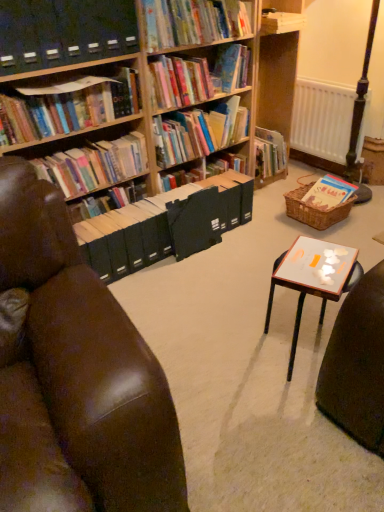
Find the location of `vacant area that is in front of hardcover book at right, the 6th book when ordered from left to right`. vacant area that is in front of hardcover book at right, the 6th book when ordered from left to right is located at coordinates (339, 227).